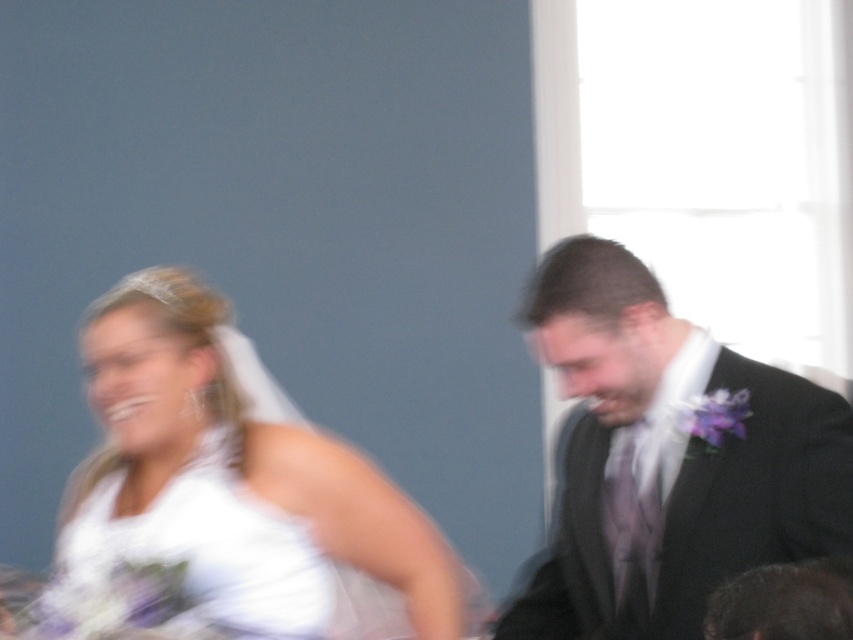
Which is below, white satin dress at left or white satin wedding dress at left?

Positioned lower is white satin wedding dress at left.

Can you confirm if white satin dress at left is smaller than white satin wedding dress at left?

No, white satin dress at left is not smaller than white satin wedding dress at left.

Does point (177, 550) lie behind point (120, 548)?

No, it is not.

The image size is (853, 640). In order to click on white satin dress at left in this screenshot , I will do `click(222, 499)`.

Measure the distance from white satin dress at left to matte black suit at right.

white satin dress at left and matte black suit at right are 15.39 inches apart from each other.

The image size is (853, 640). Describe the element at coordinates (222, 499) in the screenshot. I see `white satin dress at left` at that location.

The image size is (853, 640). I want to click on white satin dress at left, so click(222, 499).

Who is lower down, matte black suit at right or white satin wedding dress at left?

white satin wedding dress at left is lower down.

Measure the distance between matte black suit at right and white satin wedding dress at left.

A distance of 19.21 inches exists between matte black suit at right and white satin wedding dress at left.

At what (x,y) coordinates should I click in order to perform the action: click on matte black suit at right. Please return your answer as a coordinate pair (x, y). The height and width of the screenshot is (640, 853). Looking at the image, I should click on (666, 458).

Image resolution: width=853 pixels, height=640 pixels. Find the location of `matte black suit at right`. matte black suit at right is located at coordinates (666, 458).